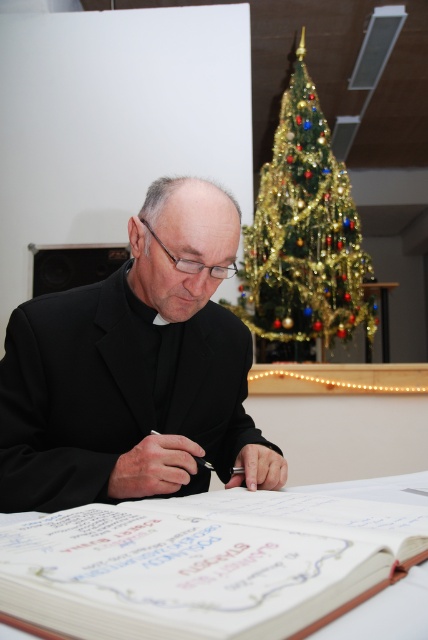
You are standing in the room and want to place a small decoration exactly at the point with coordinates point [134,371]. According to the image, where will this decoration be placed?

The point [134,371] is on the black matte suit at center, so placing the decoration there would put it on the black matte suit at center.

You are a photographer setting up for a portrait. You have a camera that can focus on objects within a 2 meter range. You want to capture both the white paper book at center and the green glittery christmas tree at upper center in sharp focus. Is this possible?

The white paper book at center and green glittery christmas tree at upper center are 2.42 meters apart, which exceeds the camera focus range of 2 meters. Therefore, both cannot be in sharp focus simultaneously.

Based on the scene described, which object occupies a larger area in the image? Please choose between the white paper book at center and the green glittery christmas tree at upper center.

The green glittery christmas tree at upper center is larger than the white paper book at center.